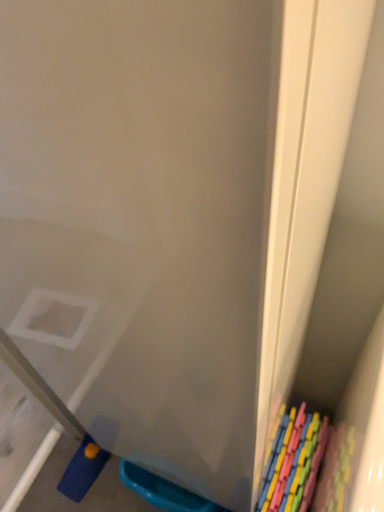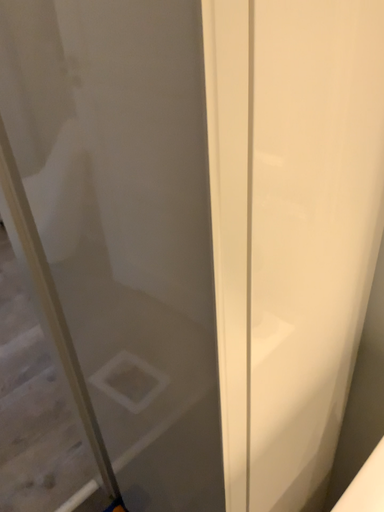
Question: How did the camera likely rotate when shooting the video?

Choices:
 (A) rotated upward
 (B) rotated downward

Answer: (A)